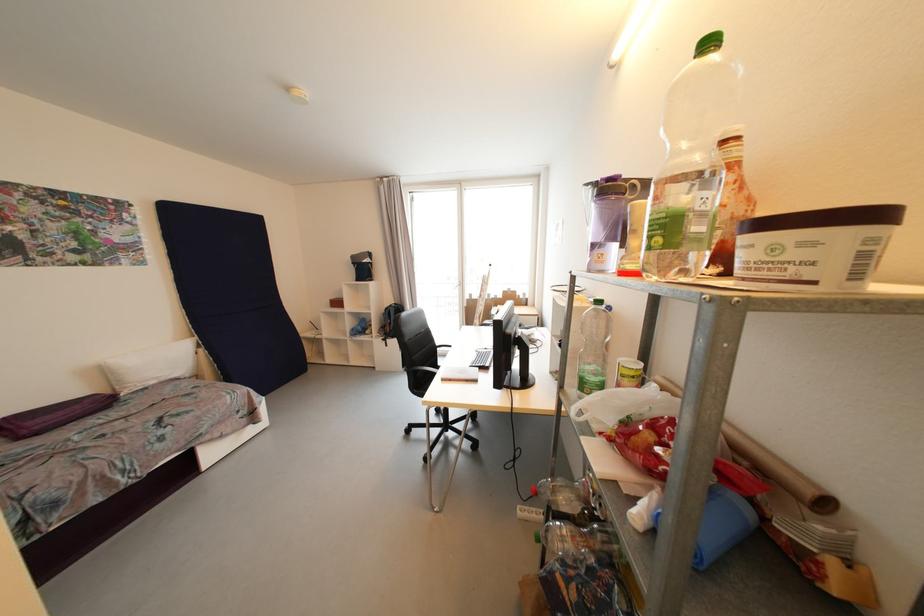
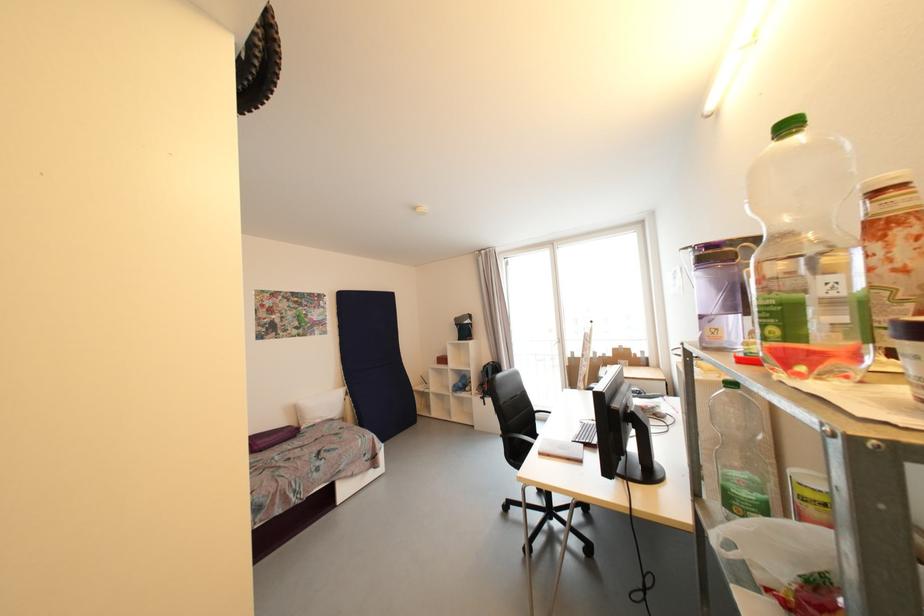
In the second image, find the point that corresponds to point (34, 426) in the first image.

(263, 445)